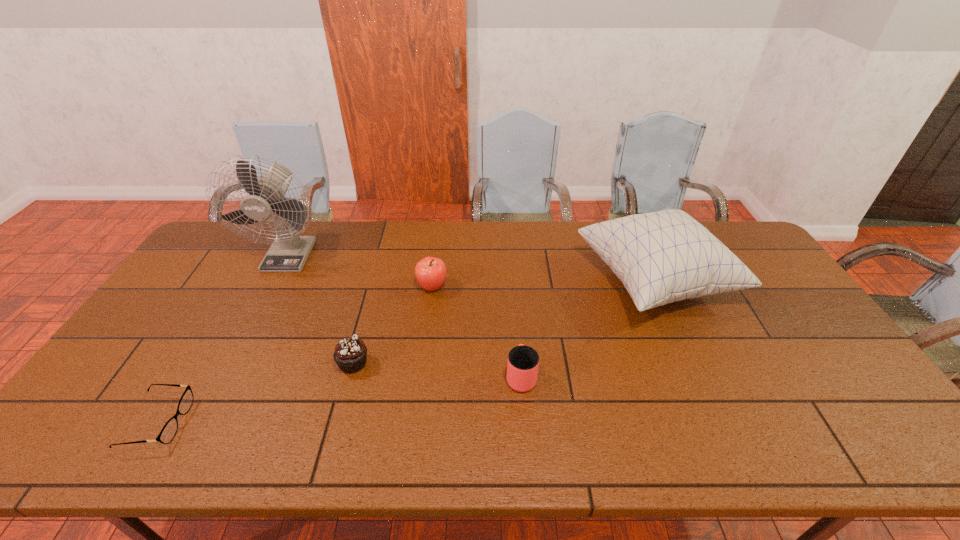
Locate an element on the screen. free location that satisfies the following two spatial constraints: 1. on the air flow direction of the fan; 2. on the front-facing side of the spectacles is located at coordinates (202, 422).

At what (x,y) coordinates should I click in order to perform the action: click on vacant space that satisfies the following two spatial constraints: 1. on the air flow direction of the tallest object; 2. on the left side of the apple. Please return your answer as a coordinate pair (x, y). The image size is (960, 540). Looking at the image, I should click on (273, 287).

Find the location of `blank space that satisfies the following two spatial constraints: 1. on the air flow direction of the tallest object; 2. on the left side of the apple`. blank space that satisfies the following two spatial constraints: 1. on the air flow direction of the tallest object; 2. on the left side of the apple is located at coordinates (273, 287).